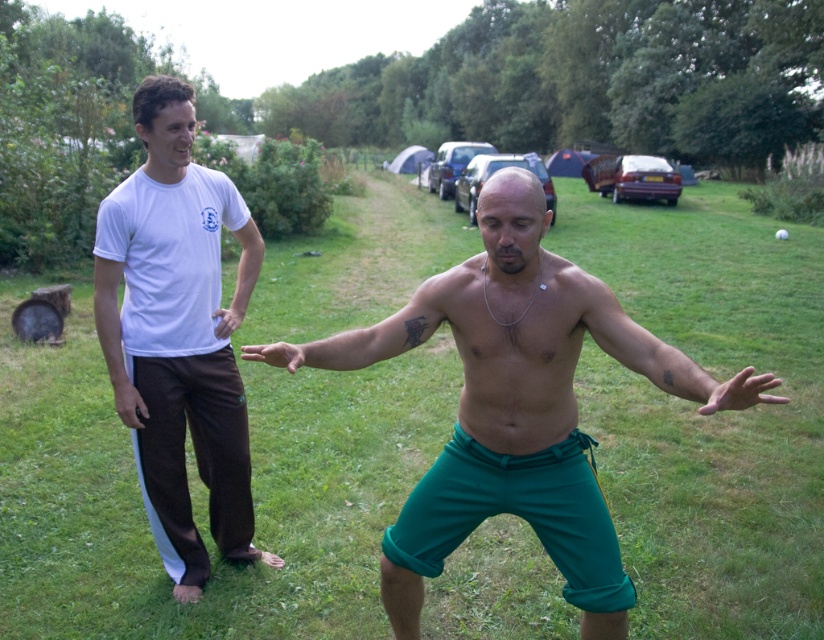
You are a photographer trying to capture a clear shot of the green grass at center and the matte white shirt at left. Which object is taller so that it might block the view of the other?

The green grass at center is taller than the matte white shirt at left, so it might block the view of the matte white shirt at left.

You are a photographer trying to capture a wide shot of the green grass at center and the black matte phone at left. Which object should you focus on to ensure both are in frame without moving the camera?

Both the green grass at center and the black matte phone at left are in the center and left, so focusing on the green grass at center would keep both in frame as the phone is to the left and the grass is central.

You are a photographer at the scene. You need to take a photo of the green fabric hand at center and the black matte phone at left. The minimum distance between the two objects in the photo must be at least 8 feet to ensure clarity. Based on the scene description, will the current positioning allow you to capture both objects clearly in one shot?

The green fabric hand at center is 7.93 feet from the black matte phone at left. Since 7.93 feet is less than the required 8 feet, the current positioning does not allow capturing both objects clearly in one shot with the minimum distance requirement.